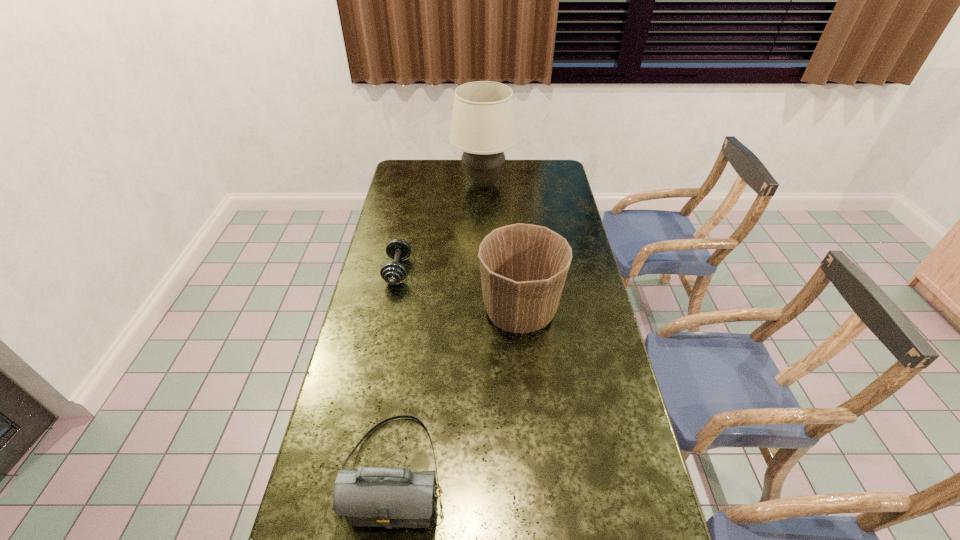
Find the location of `free spot that satisfies the following two spatial constraints: 1. on the back side of the second tallest object; 2. on the left side of the nearest object`. free spot that satisfies the following two spatial constraints: 1. on the back side of the second tallest object; 2. on the left side of the nearest object is located at coordinates (418, 312).

At what (x,y) coordinates should I click in order to perform the action: click on vacant region that satisfies the following two spatial constraints: 1. on the front side of the flowerpot; 2. on the right side of the dumbbell. Please return your answer as a coordinate pair (x, y). This screenshot has width=960, height=540. Looking at the image, I should click on (390, 312).

Where is `vacant space that satisfies the following two spatial constraints: 1. on the back side of the second shortest object; 2. on the left side of the third shortest object`? This screenshot has width=960, height=540. vacant space that satisfies the following two spatial constraints: 1. on the back side of the second shortest object; 2. on the left side of the third shortest object is located at coordinates (418, 312).